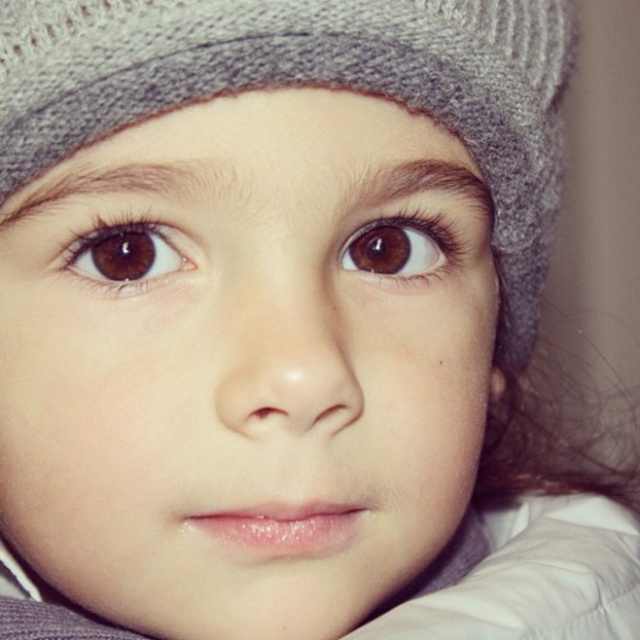
Between brown matte eye at upper left and brown matte eye at upper center, which one appears on the left side from the viewer's perspective?

Positioned to the left is brown matte eye at upper left.

Can you confirm if brown matte eye at upper left is smaller than brown matte eye at upper center?

Indeed, brown matte eye at upper left has a smaller size compared to brown matte eye at upper center.

Is point (93, 269) farther from camera compared to point (360, 248)?

No, (93, 269) is closer to viewer.

At what (x,y) coordinates should I click in order to perform the action: click on brown matte eye at upper left. Please return your answer as a coordinate pair (x, y). Looking at the image, I should click on (125, 253).